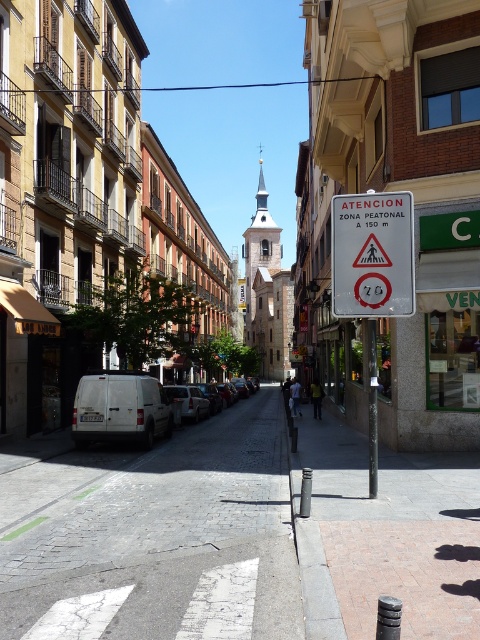
Is gray cobblestone pavement at center shorter than smooth concrete bollard at center?

No, gray cobblestone pavement at center is not shorter than smooth concrete bollard at center.

The image size is (480, 640). What do you see at coordinates (157, 536) in the screenshot? I see `gray cobblestone pavement at center` at bounding box center [157, 536].

Does point (58, 588) come in front of point (386, 476)?

That is True.

Identify the location of gray cobblestone pavement at center. The width and height of the screenshot is (480, 640). (157, 536).

Is the position of white matte van at center more distant than that of metallic silver van at center?

No, white matte van at center is closer to the viewer.

Measure the distance from white matte van at center to metallic silver van at center.

11.95 meters

Identify the location of white matte van at center. (120, 408).

Image resolution: width=480 pixels, height=640 pixels. I want to click on gray cobblestone pavement at center, so click(x=157, y=536).

Who is shorter, gray cobblestone pavement at center or metallic silver van at center?

gray cobblestone pavement at center is shorter.

What do you see at coordinates (157, 536) in the screenshot? The width and height of the screenshot is (480, 640). I see `gray cobblestone pavement at center` at bounding box center [157, 536].

Locate an element on the screen. The height and width of the screenshot is (640, 480). gray cobblestone pavement at center is located at coordinates (157, 536).